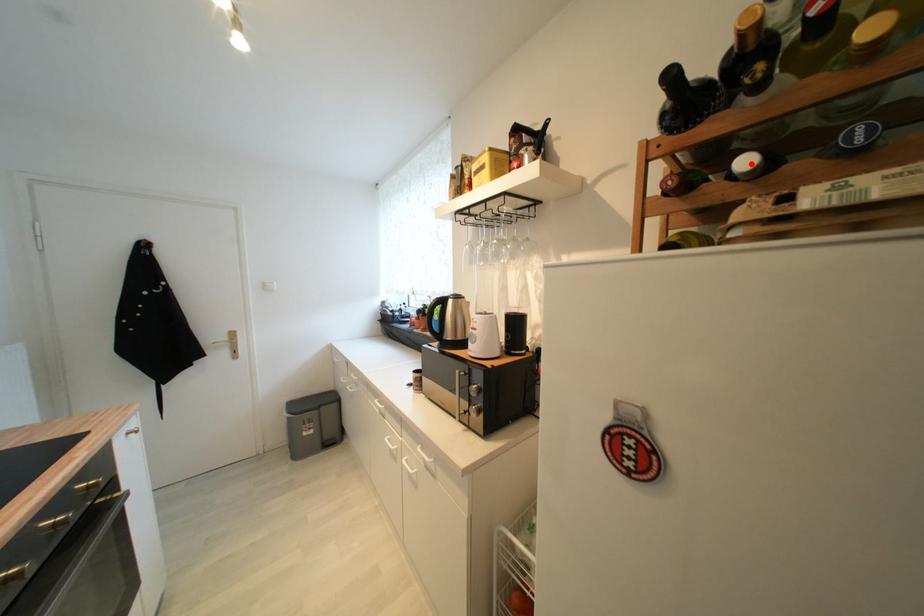
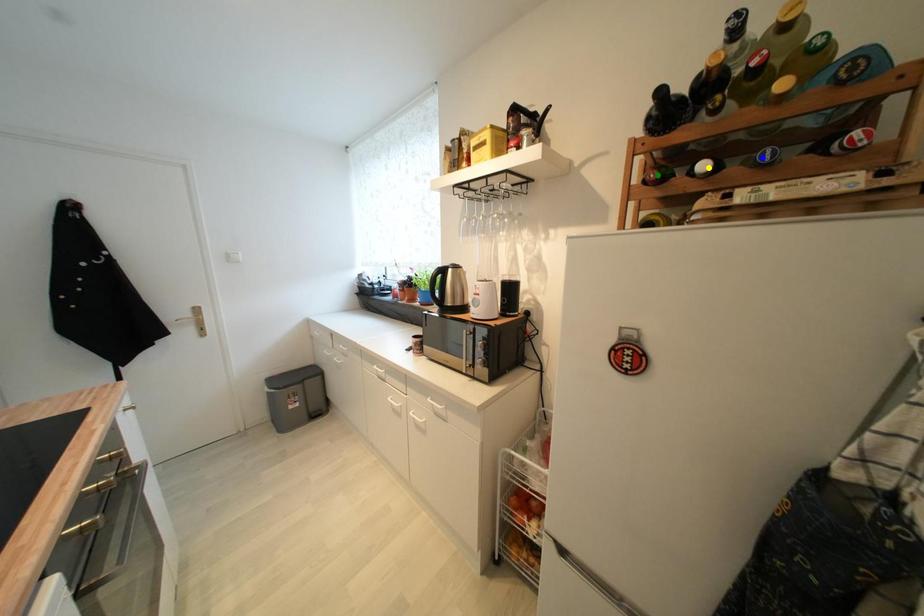
Question: I am providing you with two images of the same scene from different viewpoints. A red point is marked on the first image. You are given multiple points on the second image. Which point in image 2 represents the same 3d spot as the red point in image 1?

Choices:
 (A) yellow point
 (B) blue point
 (C) green point

Answer: (A)